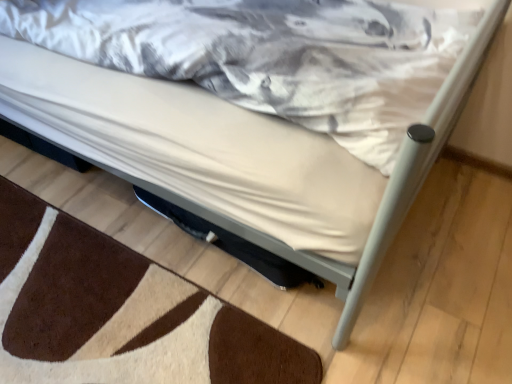
What do you see at coordinates (119, 313) in the screenshot? The width and height of the screenshot is (512, 384). I see `brown shaggy rug at lower left` at bounding box center [119, 313].

Where is `brown shaggy rug at lower left`? brown shaggy rug at lower left is located at coordinates (119, 313).

Locate an element on the screen. brown shaggy rug at lower left is located at coordinates (119, 313).